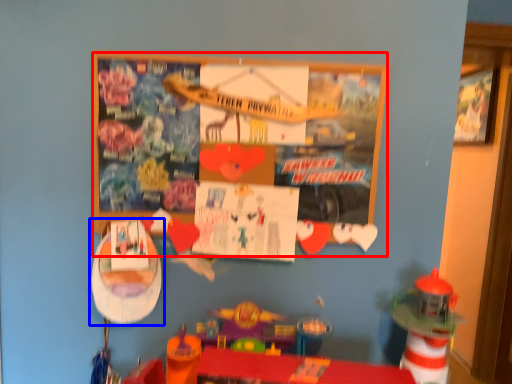
Question: Which object appears closest to the camera in this image, bulletin board (highlighted by a red box) or toy (highlighted by a blue box)?

Choices:
 (A) bulletin board
 (B) toy

Answer: (A)